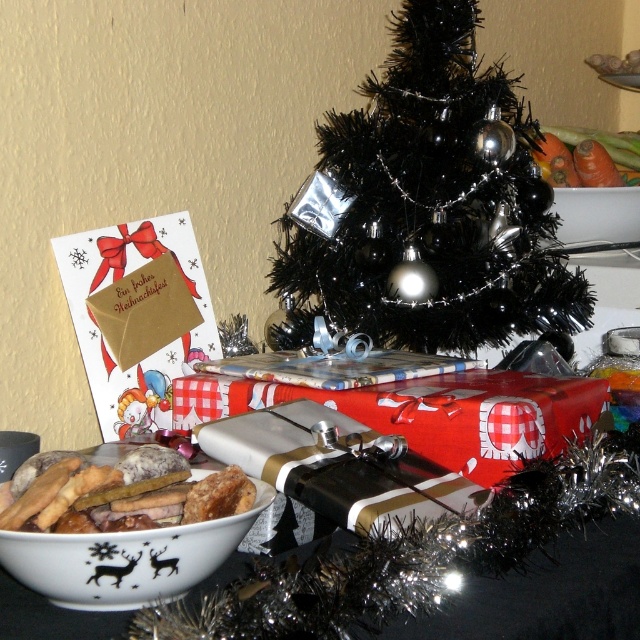
You are planning to place a decorative bowl on the table next to the black shiny christmas tree at center. The bowl you have is the same size as the white glossy bowl at upper center. Will the space next to the tree accommodate the bowl without overcrowding?

The black shiny christmas tree at center is wider than the white glossy bowl at upper center. Since the bowl you have is the same size as the white glossy bowl at upper center, there should be enough space next to the tree to place it without overcrowding.

You are setting up a camera to take a photo of the white ceramic bowl at lower left. The camera is currently positioned 18.92 inches away from the bowl. Is the camera close enough to capture the bowl in focus without moving it?

The white ceramic bowl at lower left and camera are 18.92 inches apart from each other. Since the camera is positioned at this exact distance, it should be close enough to capture the bowl in focus without needing to move it.